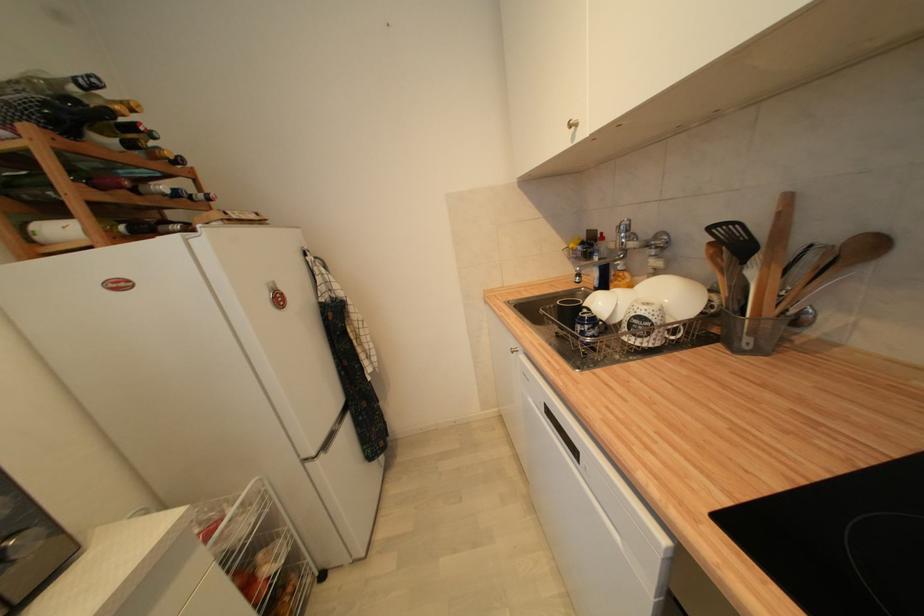
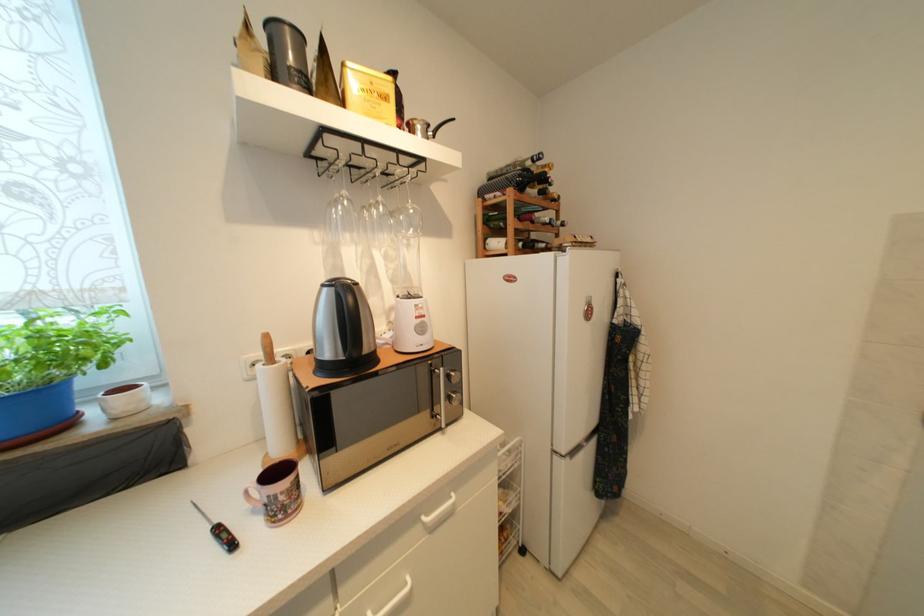
The point at [112,143] is marked in the first image. Where is the corresponding point in the second image?

(538, 193)